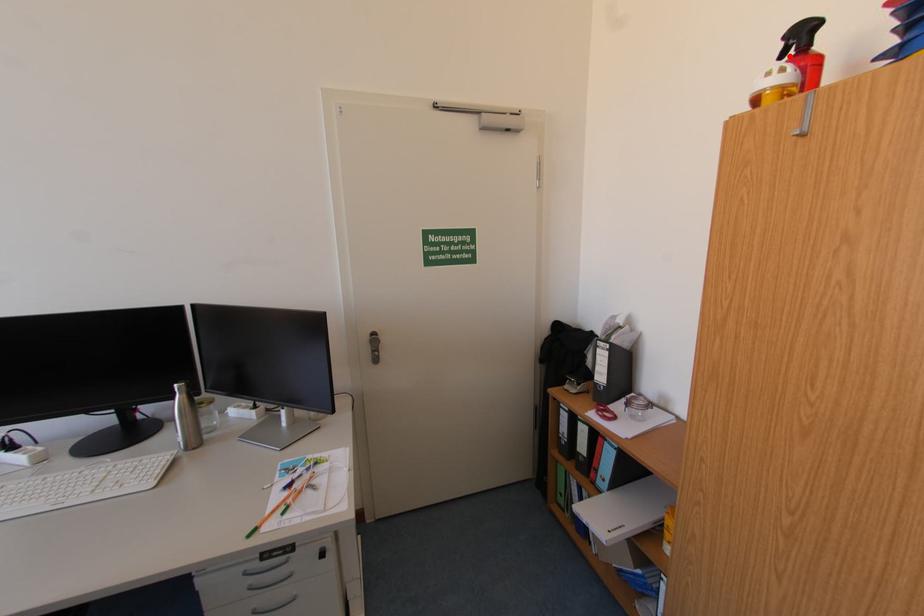
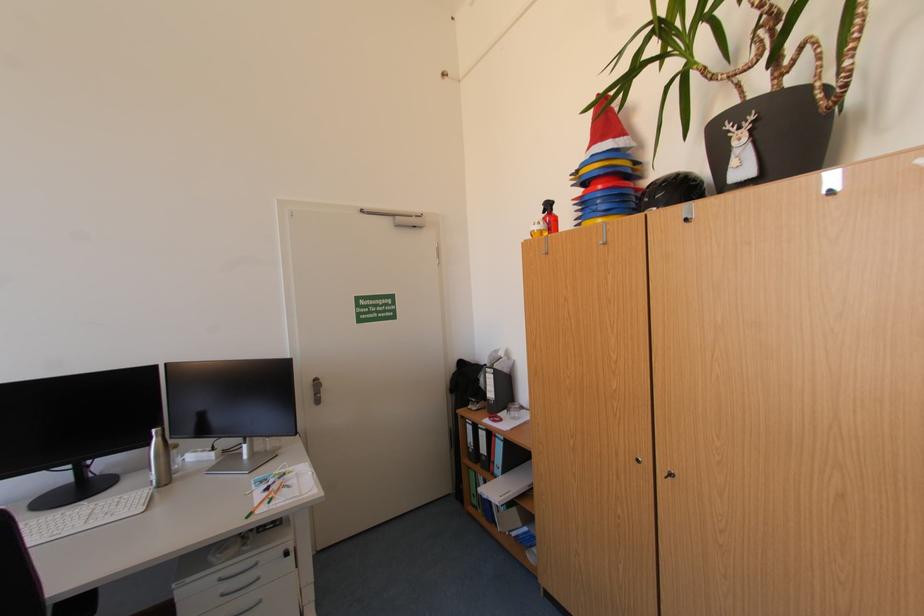
Find the pixel in the second image that matches the highlighted location in the first image.

(552, 213)